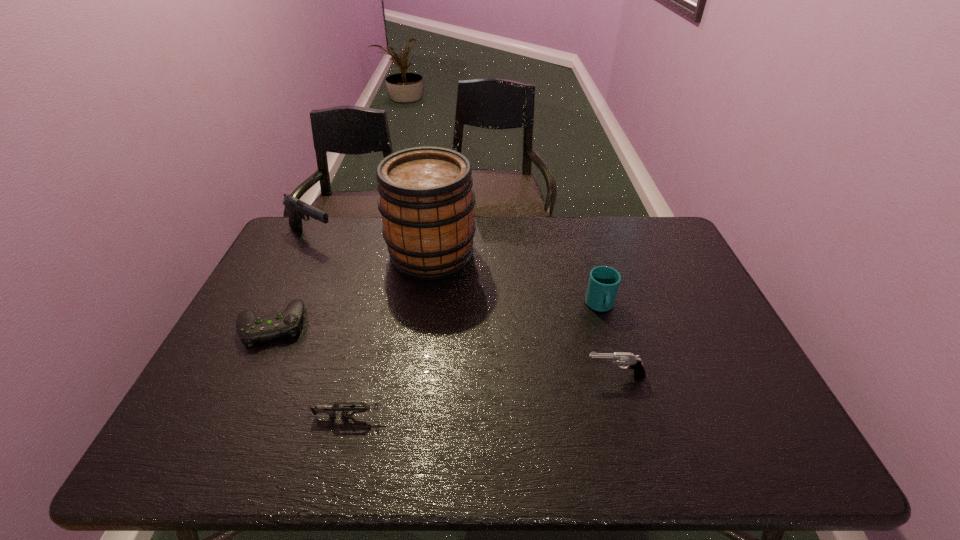
Where is `vacant position located 0.400m at the muzzle of the leftmost gun`? vacant position located 0.400m at the muzzle of the leftmost gun is located at coordinates (454, 238).

Where is `free location located on the handle side of the cup`? free location located on the handle side of the cup is located at coordinates (623, 385).

The image size is (960, 540). Find the location of `vacant space located at the muzzle of the rightmost gun`. vacant space located at the muzzle of the rightmost gun is located at coordinates (493, 375).

Identify the location of vacant space located 0.400m at the muzzle of the rightmost gun. The width and height of the screenshot is (960, 540). (425, 375).

Image resolution: width=960 pixels, height=540 pixels. I want to click on free space located 0.310m at the muzzle of the rightmost gun, so click(x=461, y=375).

Find the location of a particular element. This screenshot has width=960, height=540. free space located 0.400m aimed along the barrel of the second gun from left to right is located at coordinates (564, 416).

Where is `free space located 0.120m on the right of the control`? free space located 0.120m on the right of the control is located at coordinates (348, 325).

Identify the location of cider present at the far edge. (426, 200).

Find the location of `gun that is at the far edge`. gun that is at the far edge is located at coordinates (297, 209).

Image resolution: width=960 pixels, height=540 pixels. In order to click on gun that is at the left edge in this screenshot , I will do `click(297, 209)`.